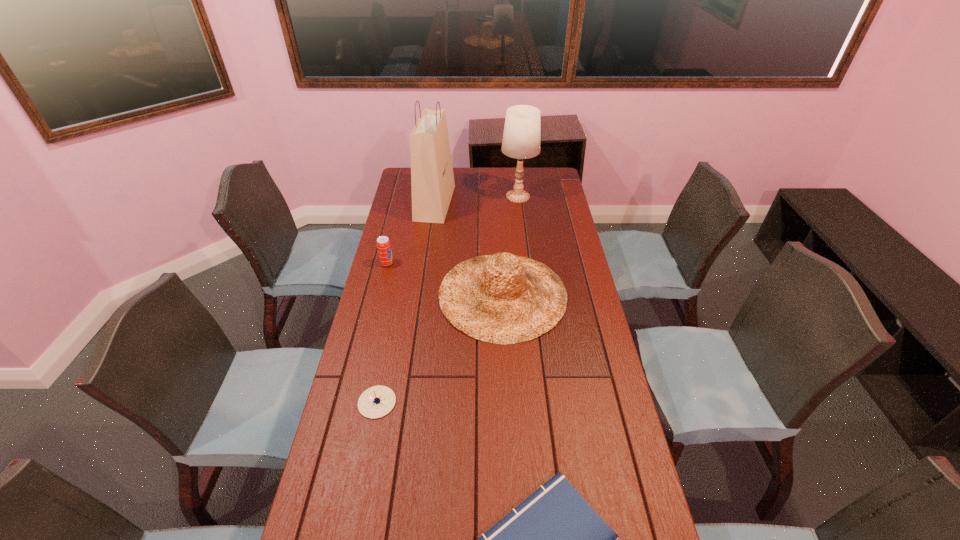
Where is `free location located 0.180m on the front of the second nearest object`? free location located 0.180m on the front of the second nearest object is located at coordinates (361, 484).

Locate an element on the screen. This screenshot has height=540, width=960. shopping bag that is at the far edge is located at coordinates (432, 180).

At what (x,y) coordinates should I click in order to perform the action: click on lamp present at the far edge. Please return your answer as a coordinate pair (x, y). The height and width of the screenshot is (540, 960). Looking at the image, I should click on (522, 136).

At what (x,y) coordinates should I click in order to perform the action: click on shopping bag situated at the left edge. Please return your answer as a coordinate pair (x, y). This screenshot has width=960, height=540. Looking at the image, I should click on pos(432,180).

Where is `soda can present at the left edge`? The height and width of the screenshot is (540, 960). soda can present at the left edge is located at coordinates [383, 244].

What are the coordinates of `compass that is at the left edge` in the screenshot? It's located at (375, 402).

Where is `lamp that is at the right edge`? lamp that is at the right edge is located at coordinates (522, 136).

The height and width of the screenshot is (540, 960). What are the coordinates of `sunhat present at the right edge` in the screenshot? It's located at (504, 299).

You are a GUI agent. You are given a task and a screenshot of the screen. Output one action in this format:
    pyautogui.click(x=<x>, y=<y>)
    Task: Click on the object located in the far left corner section of the desktop
    The image size is (960, 540).
    Given the screenshot: What is the action you would take?
    pyautogui.click(x=432, y=180)

This screenshot has width=960, height=540. Identify the location of object that is at the far right corner. (522, 136).